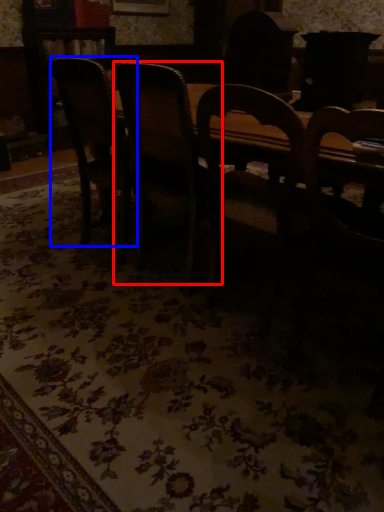
Question: Which of the following is the farthest to the observer, chair (highlighted by a red box) or chair (highlighted by a blue box)?

Choices:
 (A) chair
 (B) chair

Answer: (B)